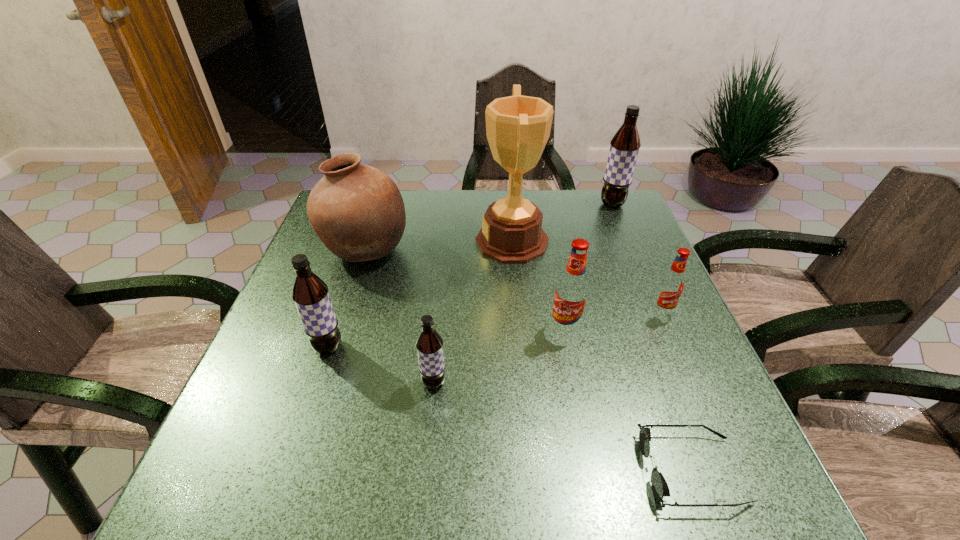
This screenshot has height=540, width=960. I want to click on root beer that is at the left edge, so click(x=310, y=294).

At what (x,y) coordinates should I click in order to perform the action: click on sunglasses that is at the right edge. Please return your answer as a coordinate pair (x, y). Image resolution: width=960 pixels, height=540 pixels. Looking at the image, I should click on (660, 488).

Find the location of a particular element. object present at the far left corner is located at coordinates (357, 211).

This screenshot has width=960, height=540. Identify the location of object situated at the far right corner. (624, 147).

You are a GUI agent. You are given a task and a screenshot of the screen. Output one action in this format:
    pyautogui.click(x=<x>, y=<y>)
    Task: Click on the object at the near right corner
    
    Given the screenshot: What is the action you would take?
    pyautogui.click(x=660, y=488)

Locate an element on the screen. Image resolution: width=960 pixels, height=540 pixels. vacant space at the far edge of the desktop is located at coordinates (x=421, y=191).

Identify the location of free space at the near edge of the desktop. (411, 497).

In the image, there is a desktop. At what (x,y) coordinates should I click in order to perform the action: click on vacant space at the left edge. Please return your answer as a coordinate pair (x, y). The width and height of the screenshot is (960, 540). Looking at the image, I should click on (260, 407).

In the image, there is a desktop. Find the location of `vacant space at the right edge`. vacant space at the right edge is located at coordinates (647, 256).

Image resolution: width=960 pixels, height=540 pixels. I want to click on free space between the nearest object and the sixth object from right to left, so click(563, 426).